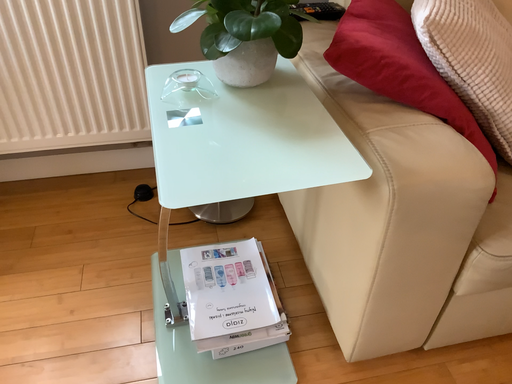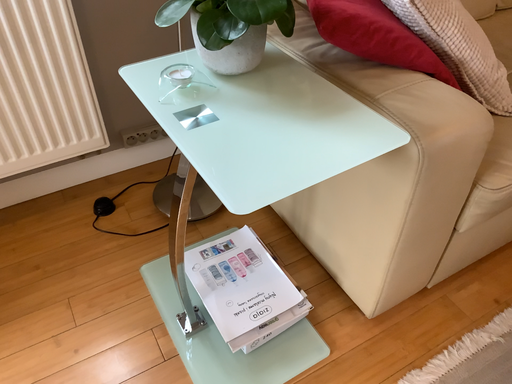
Question: How did the camera likely rotate when shooting the video?

Choices:
 (A) rotated left
 (B) rotated right

Answer: (B)